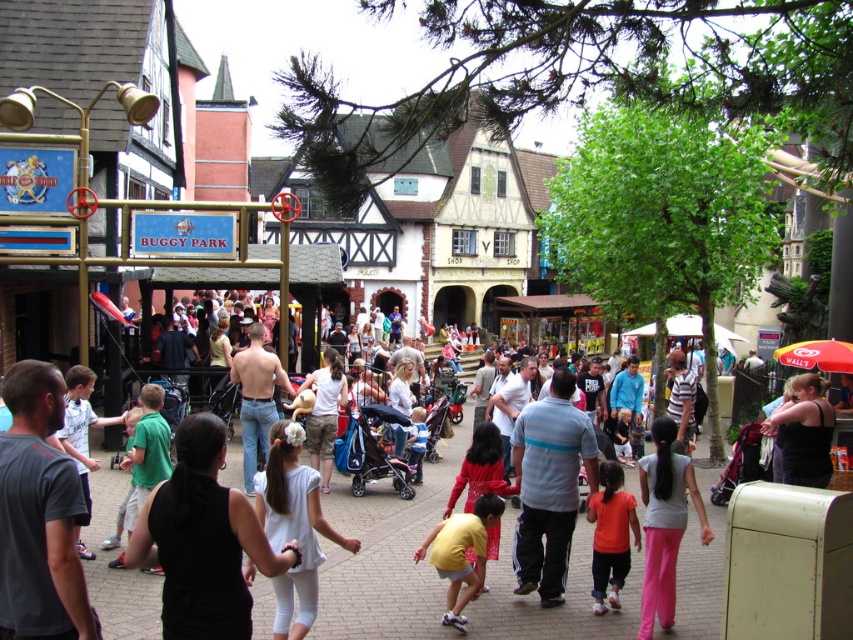
Which is below, yellow matte shirt at center or orange cotton shirt at center?

Positioned lower is yellow matte shirt at center.

Does yellow matte shirt at center appear on the right side of orange cotton shirt at center?

In fact, yellow matte shirt at center is to the left of orange cotton shirt at center.

Identify the location of yellow matte shirt at center. The height and width of the screenshot is (640, 853). (461, 554).

Where is `yellow matte shirt at center`? The height and width of the screenshot is (640, 853). yellow matte shirt at center is located at coordinates click(x=461, y=554).